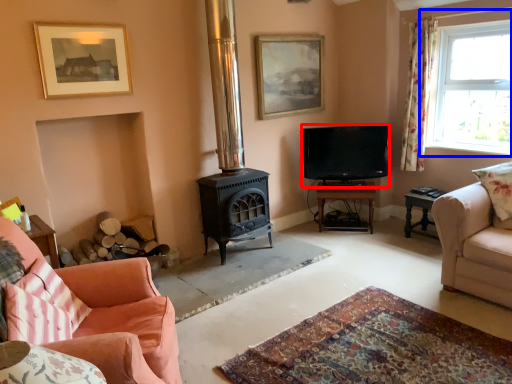
Question: Which of the following is the closest to the observer, television (highlighted by a red box) or window (highlighted by a blue box)?

Choices:
 (A) television
 (B) window

Answer: (B)